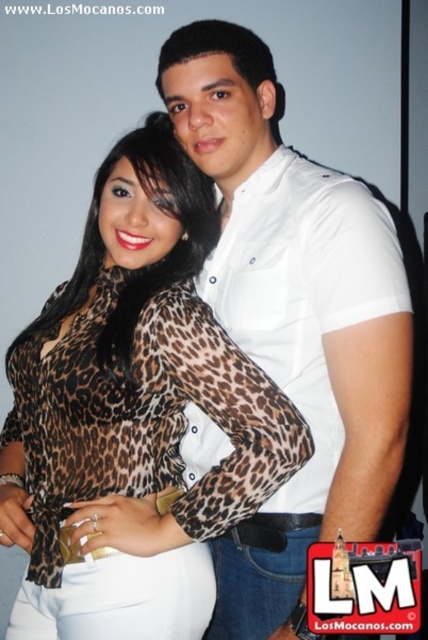
Looking at this image, does leopard print blouse at center have a greater height compared to white smooth shirt at center?

Incorrect, leopard print blouse at center's height is not larger of white smooth shirt at center's.

Does point (181, 493) come closer to viewer compared to point (380, 228)?

No.

This screenshot has height=640, width=428. What are the coordinates of `leopard print blouse at center` in the screenshot? It's located at (136, 412).